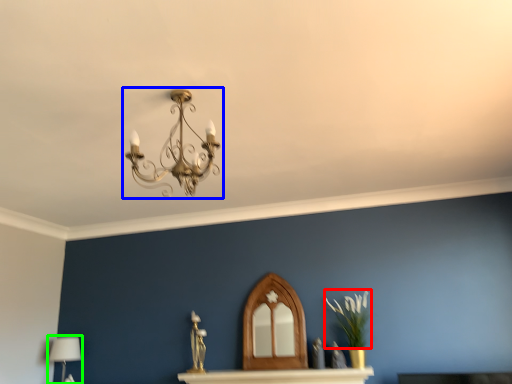
Question: Considering the real-world distances, which object is farthest from plant (highlighted by a red box)? lamp (highlighted by a blue box) or table lamp (highlighted by a green box)?

Choices:
 (A) lamp
 (B) table lamp

Answer: (B)